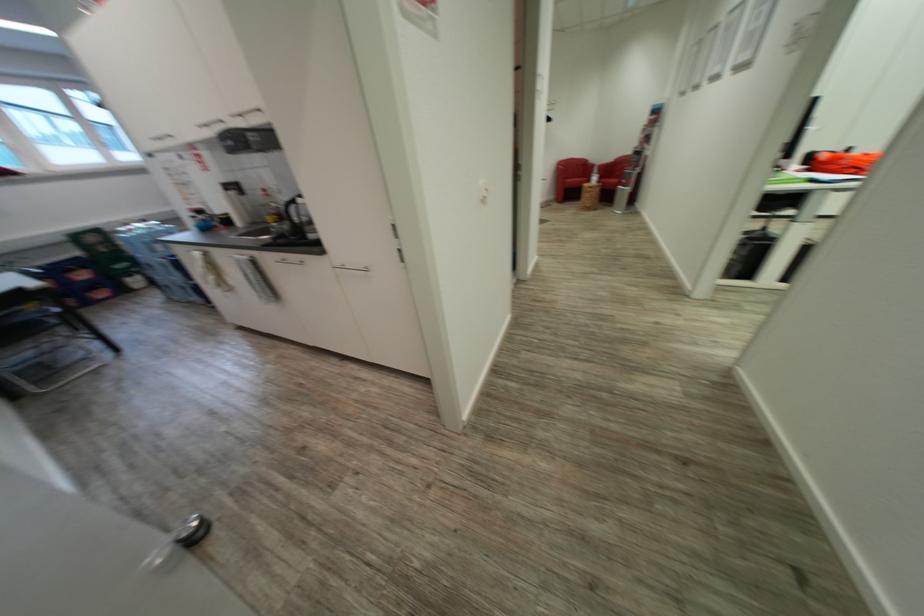
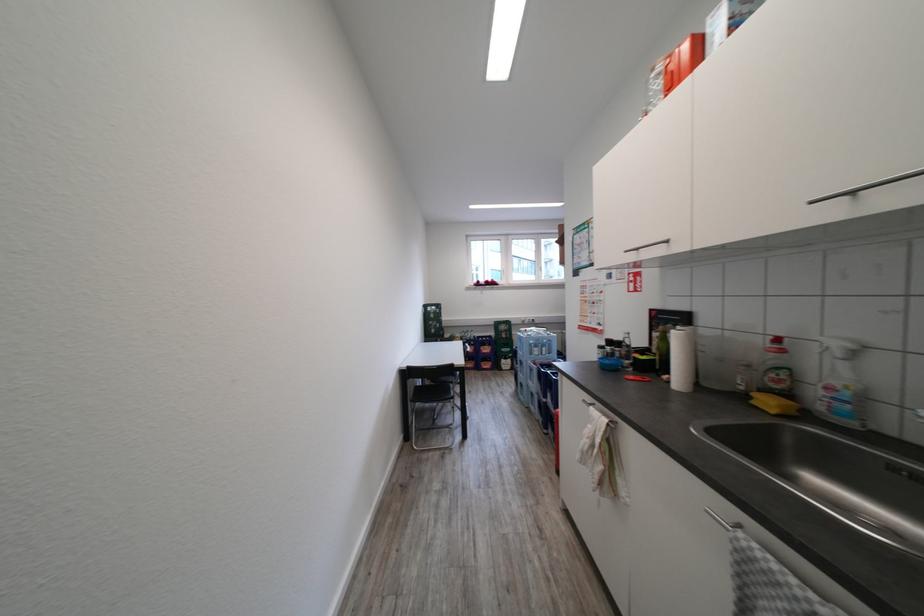
The point at (263, 190) is marked in the first image. Where is the corresponding point in the second image?

(776, 339)